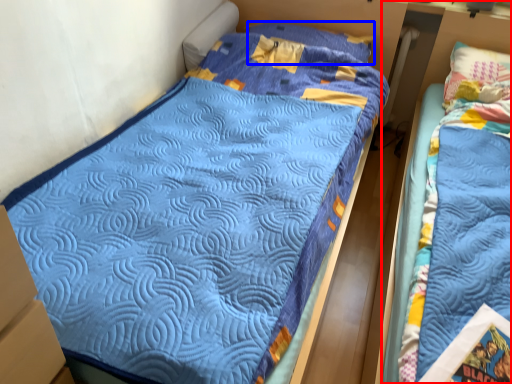
Question: Which of the following is the farthest to the observer, bed (highlighted by a red box) or pillow (highlighted by a blue box)?

Choices:
 (A) bed
 (B) pillow

Answer: (B)